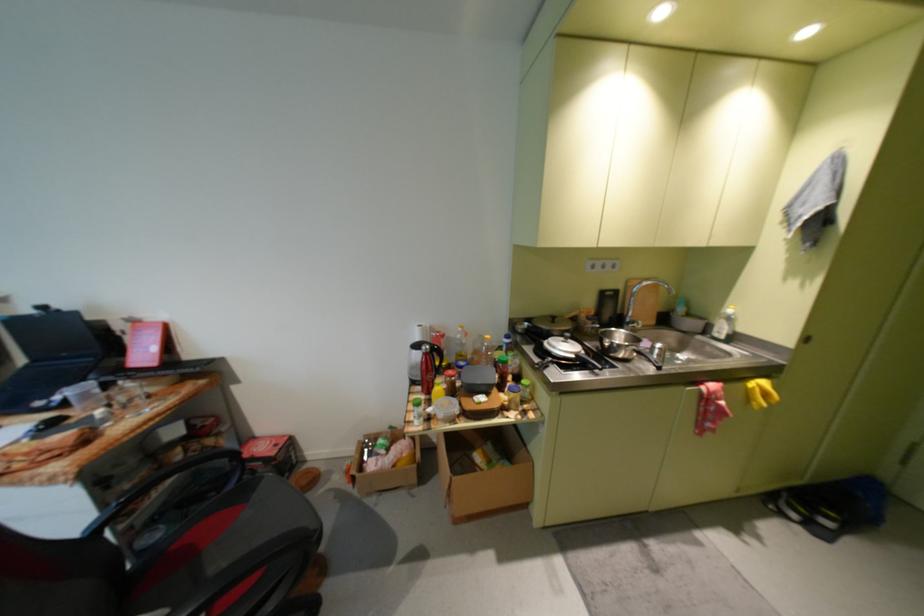
The width and height of the screenshot is (924, 616). What do you see at coordinates (568, 361) in the screenshot?
I see `the black handlebar grip` at bounding box center [568, 361].